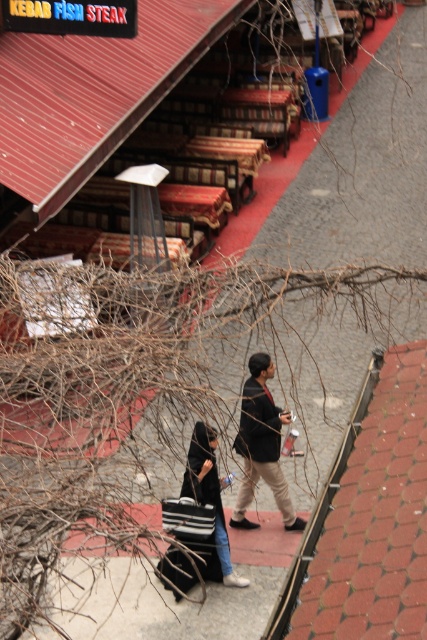
Question: Does dark brown leather jacket at center appear on the left side of striped fabric shopping bag at lower center?

Choices:
 (A) yes
 (B) no

Answer: (B)

Question: Which object is farther from the camera taking this photo?

Choices:
 (A) black fabric bag at center
 (B) dark brown leather jacket at center
 (C) striped fabric shopping bag at lower center

Answer: (B)

Question: Is black fabric bag at center further to the viewer compared to striped fabric shopping bag at lower center?

Choices:
 (A) yes
 (B) no

Answer: (B)

Question: In this image, where is dark brown leather jacket at center located relative to striped fabric shopping bag at lower center?

Choices:
 (A) below
 (B) above

Answer: (B)

Question: Which object appears farthest from the camera in this image?

Choices:
 (A) dark brown leather jacket at center
 (B) striped fabric shopping bag at lower center
 (C) black fabric bag at center

Answer: (A)

Question: Estimate the real-world distances between objects in this image. Which object is closer to the black fabric bag at center?

Choices:
 (A) striped fabric shopping bag at lower center
 (B) dark brown leather jacket at center

Answer: (A)